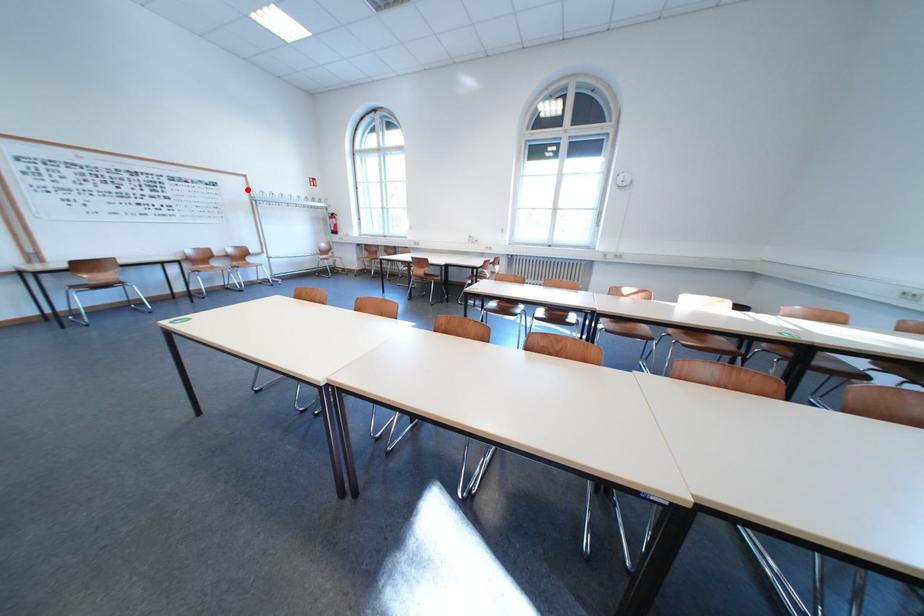
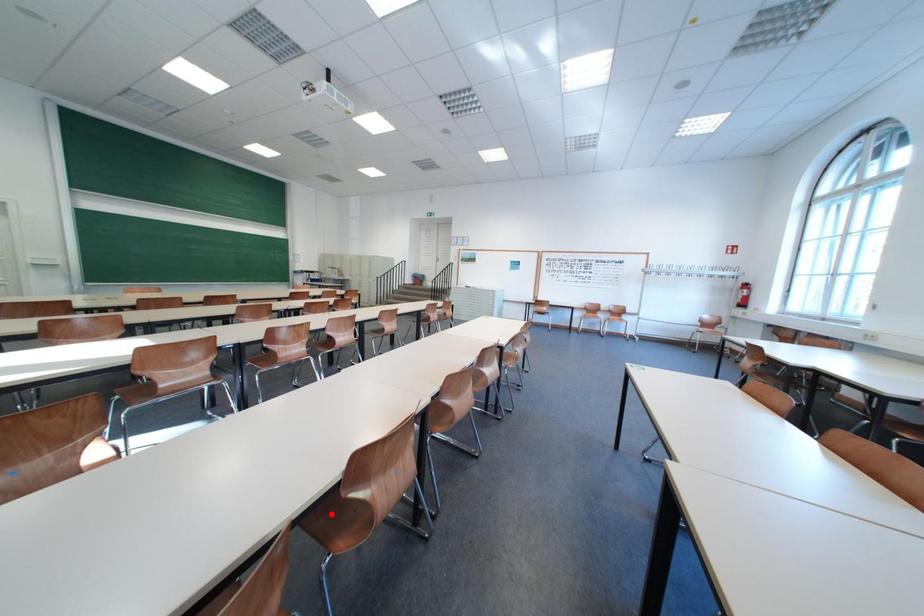
I am providing you with two images of the same scene from different viewpoints. A red point is marked on the first image and another point is marked on the second image. Are the points marked in image1 and image2 representing the same 3D position?

No